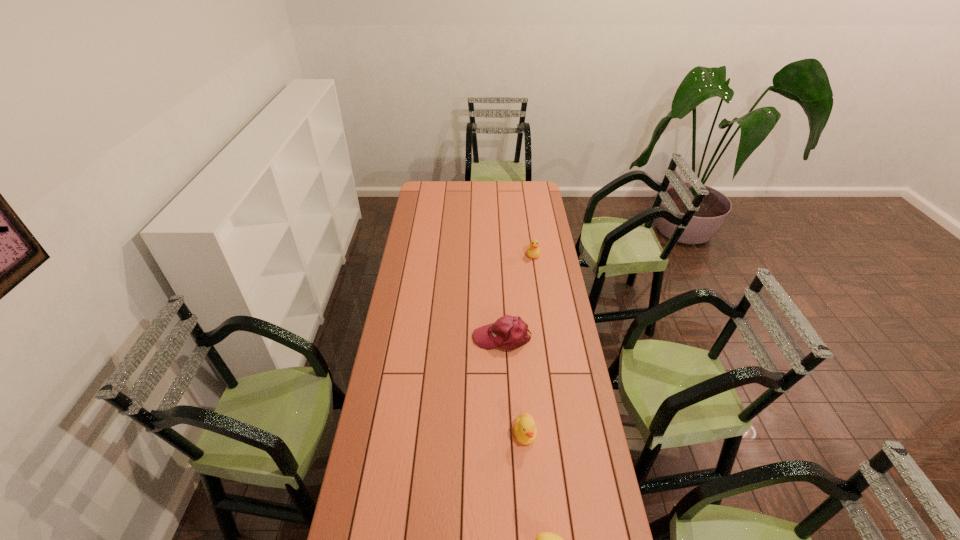
Identify the location of vacant space at the left edge of the desktop. Image resolution: width=960 pixels, height=540 pixels. (377, 467).

At what (x,y) coordinates should I click in order to perform the action: click on vacant space at the right edge of the desktop. Please return your answer as a coordinate pair (x, y). This screenshot has width=960, height=540. Looking at the image, I should click on click(583, 483).

Locate an element on the screen. vacant region at the far left corner of the desktop is located at coordinates (440, 181).

Find the location of a particular element. The height and width of the screenshot is (540, 960). empty location between the third farthest object and the second farthest object is located at coordinates (514, 386).

I want to click on unoccupied position between the second nearest duck and the second farthest object, so click(514, 386).

Select which object is the second closest to the second farthest object. Please provide its 2D coordinates. Your answer should be formatted as a tuple, i.e. [(x, y)], where the tuple contains the x and y coordinates of a point satisfying the conditions above.

[(533, 251)]

Identify the location of object that is the third closest to the baseball cap. The height and width of the screenshot is (540, 960). (546, 539).

Identify which duck is the second closest to the nearest object. Please provide its 2D coordinates. Your answer should be formatted as a tuple, i.e. [(x, y)], where the tuple contains the x and y coordinates of a point satisfying the conditions above.

[(533, 251)]

Locate which duck is the second closest to the nearest duck. Please provide its 2D coordinates. Your answer should be formatted as a tuple, i.e. [(x, y)], where the tuple contains the x and y coordinates of a point satisfying the conditions above.

[(533, 251)]

Where is `vacant space that satisfies the following two spatial constraints: 1. at the beak of the farthest duck; 2. at the front of the third nearest object with the brim`? vacant space that satisfies the following two spatial constraints: 1. at the beak of the farthest duck; 2. at the front of the third nearest object with the brim is located at coordinates (545, 338).